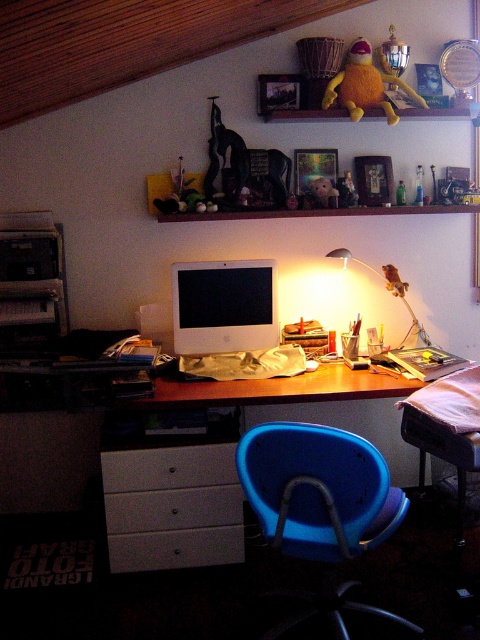
You are organizing your home office and need to place a new 18x18 inch box between the white matte computer desk at center and the white matte drawer at lower left. Can the box fit vertically between them?

The white matte computer desk at center is above the white matte drawer at lower left, so there is vertical space between them. Since the box is 18x18 inches, it might fit depending on the exact vertical clearance. However, the description does not provide specific measurements, so we cannot confirm for certain.

You are setting up a new desk in your loft. The white matte computer desk at center needs to be placed exactly at point 0.792, 0.358. Can you confirm the coordinates where the desk should be positioned?

The white matte computer desk at center should be placed at coordinates (171, 506) as specified.